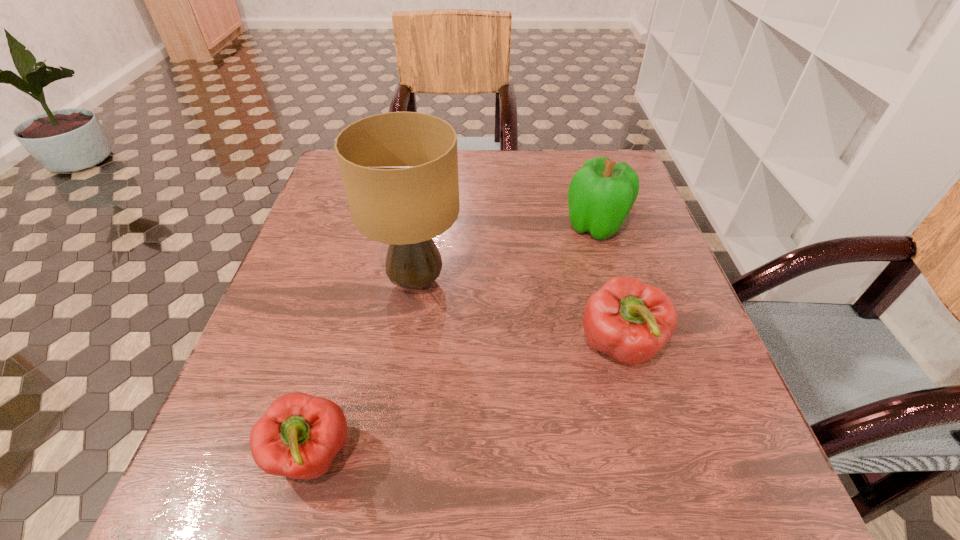
The height and width of the screenshot is (540, 960). I want to click on blank area located 0.160m on the right of the leftmost bell pepper, so click(x=461, y=455).

Where is `object located in the near edge section of the desktop`? The image size is (960, 540). object located in the near edge section of the desktop is located at coordinates (x=299, y=435).

Find the location of a particular element. object present at the left edge is located at coordinates (299, 435).

Find the location of `object at the near left corner`. object at the near left corner is located at coordinates (299, 435).

You are a GUI agent. You are given a task and a screenshot of the screen. Output one action in this format:
    pyautogui.click(x=<x>, y=<y>)
    Task: Click on the vacant space at the near edge of the desktop
    The height and width of the screenshot is (540, 960).
    Given the screenshot: What is the action you would take?
    pyautogui.click(x=636, y=496)

At what (x,y) coordinates should I click in order to perform the action: click on free location at the left edge of the desktop. Please return your answer as a coordinate pair (x, y). Looking at the image, I should click on (326, 394).

Image resolution: width=960 pixels, height=540 pixels. In order to click on free spot at the right edge of the desktop in this screenshot , I will do `click(684, 301)`.

This screenshot has height=540, width=960. In the image, there is a desktop. In order to click on free space at the near right corner in this screenshot , I will do `click(660, 494)`.

Where is `free space that is in between the tallest object and the second tallest object`? The height and width of the screenshot is (540, 960). free space that is in between the tallest object and the second tallest object is located at coordinates (506, 253).

The width and height of the screenshot is (960, 540). In order to click on vacant space that's between the lampshade and the nearest bell pepper in this screenshot , I will do `click(365, 368)`.